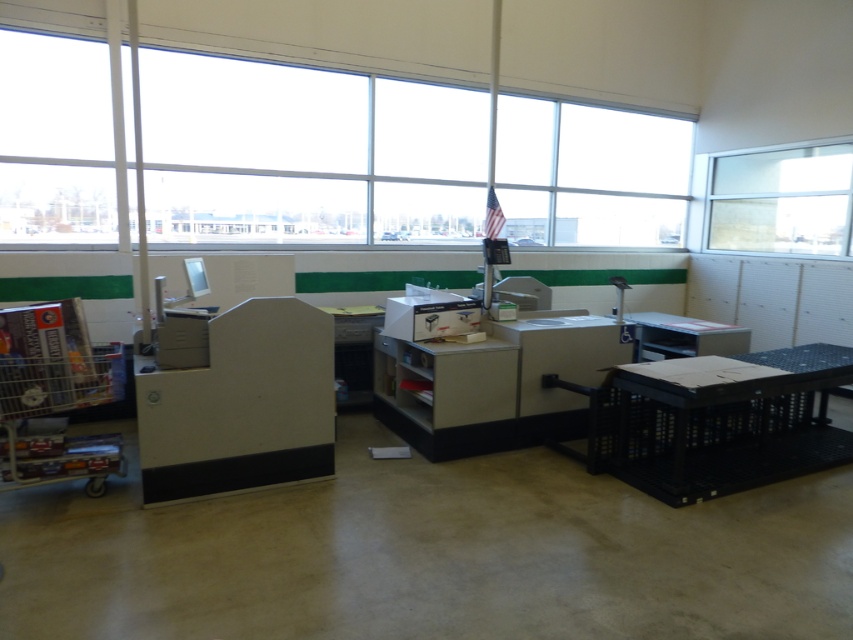
Can you confirm if transparent glass window at upper center is taller than matte gray table at right?

Indeed, transparent glass window at upper center has a greater height compared to matte gray table at right.

Does point (482, 131) come closer to viewer compared to point (668, 339)?

No.

You are a GUI agent. You are given a task and a screenshot of the screen. Output one action in this format:
    pyautogui.click(x=<x>, y=<y>)
    Task: Click on the transparent glass window at upper center
    Image resolution: width=853 pixels, height=640 pixels.
    Given the screenshot: What is the action you would take?
    pos(306,154)

Image resolution: width=853 pixels, height=640 pixels. Find the location of `transparent glass window at upper center`. transparent glass window at upper center is located at coordinates (306, 154).

Which of these two, transparent glass window at upper center or clear glass window at upper right, stands shorter?

clear glass window at upper right is shorter.

In the scene shown: Between transparent glass window at upper center and clear glass window at upper right, which one has more height?

With more height is transparent glass window at upper center.

Is point (444, 227) closer to camera compared to point (840, 218)?

No, (444, 227) is further to viewer.

Find the location of `transparent glass window at upper center`. transparent glass window at upper center is located at coordinates click(x=306, y=154).

Does clear glass window at upper right appear over matte gray table at right?

Correct, clear glass window at upper right is located above matte gray table at right.

Is clear glass window at upper right below matte gray table at right?

Actually, clear glass window at upper right is above matte gray table at right.

Where is `clear glass window at upper right`? clear glass window at upper right is located at coordinates (782, 200).